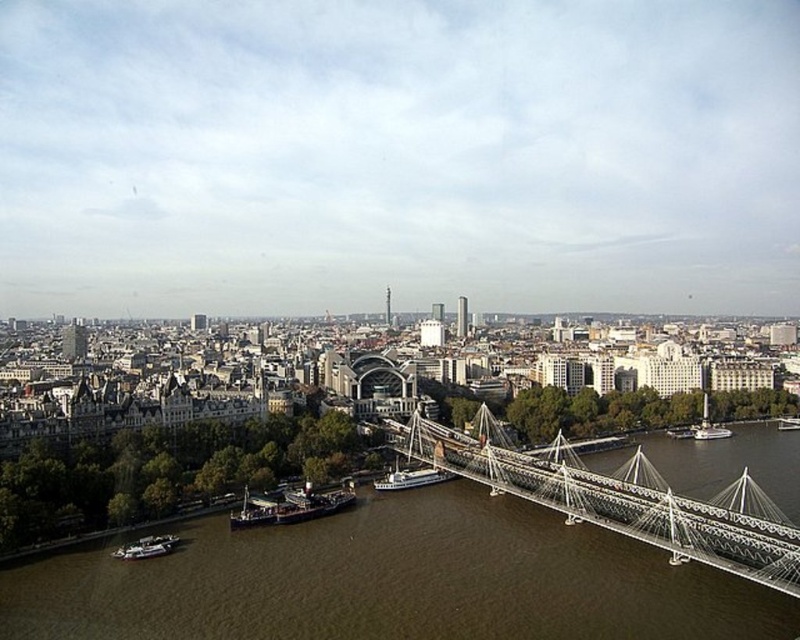
Between metallic silver boat at right and metallic silver boat at lower right, which one appears on the right side from the viewer's perspective?

metallic silver boat at right is more to the right.

Is point (725, 433) positioned in front of point (682, 432)?

Yes, point (725, 433) is in front of point (682, 432).

Who is more forward, (696, 440) or (676, 435)?

Positioned in front is point (696, 440).

Locate an element on the screen. Image resolution: width=800 pixels, height=640 pixels. metallic silver boat at right is located at coordinates (709, 429).

Can you confirm if dark gray metallic ship at lower center is taller than metallic silver boat at right?

Yes.

What do you see at coordinates (290, 506) in the screenshot?
I see `dark gray metallic ship at lower center` at bounding box center [290, 506].

Is point (284, 497) closer to viewer compared to point (708, 440)?

Yes, point (284, 497) is in front of point (708, 440).

At what (x,y) coordinates should I click in order to perform the action: click on dark gray metallic ship at lower center. Please return your answer as a coordinate pair (x, y). This screenshot has height=640, width=800. Looking at the image, I should click on (290, 506).

Who is more distant from viewer, (725,531) or (128,556)?

→ The point (128,556) is more distant.

Looking at this image, is white metallic suspension bridge at center-right taller than metallic gray boat at lower left?

Yes.

What do you see at coordinates (614, 504) in the screenshot? I see `white metallic suspension bridge at center-right` at bounding box center [614, 504].

You are a GUI agent. You are given a task and a screenshot of the screen. Output one action in this format:
    pyautogui.click(x=<x>, y=<y>)
    Task: Click on the white metallic suspension bridge at center-right
    The image size is (800, 640).
    Given the screenshot: What is the action you would take?
    pyautogui.click(x=614, y=504)